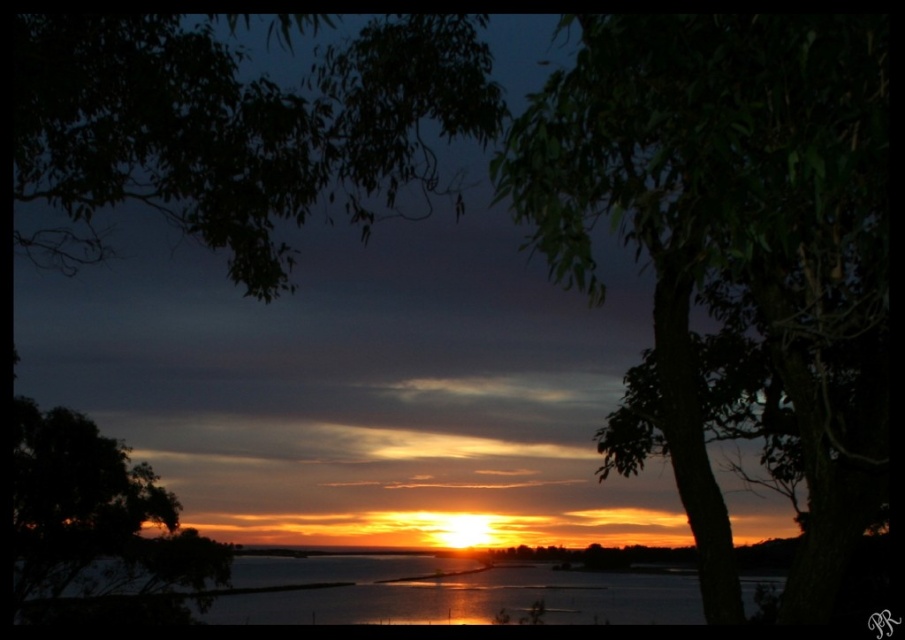
Question: Considering the real-world distances, which object is farthest from the dark green leafy tree at lower left?

Choices:
 (A) green leafy tree at upper right
 (B) shiny reflective water at center
 (C) dark green leafy tree at upper left

Answer: (A)

Question: Among these points, which one is farthest from the camera?

Choices:
 (A) (446, 609)
 (B) (169, 157)
 (C) (162, 573)
 (D) (799, 124)

Answer: (C)

Question: Is dark green leafy tree at upper left positioned in front of dark green leafy tree at lower left?

Choices:
 (A) no
 (B) yes

Answer: (B)

Question: Estimate the real-world distances between objects in this image. Which object is closer to the dark green leafy tree at upper left?

Choices:
 (A) shiny reflective water at center
 (B) dark green leafy tree at lower left
 (C) green leafy tree at upper right

Answer: (C)

Question: Considering the relative positions of green leafy tree at upper right and dark green leafy tree at upper left in the image provided, where is green leafy tree at upper right located with respect to dark green leafy tree at upper left?

Choices:
 (A) above
 (B) below

Answer: (B)

Question: Is green leafy tree at upper right further to the viewer compared to dark green leafy tree at upper left?

Choices:
 (A) yes
 (B) no

Answer: (B)